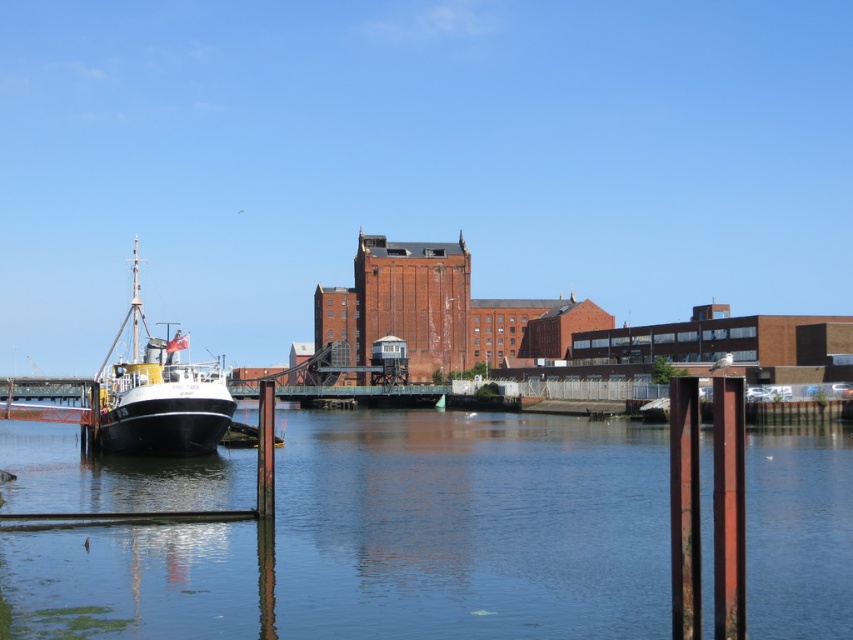
Does clear blue water at center appear over polished black ship at left?

No.

Can you confirm if clear blue water at center is smaller than polished black ship at left?

Correct, clear blue water at center occupies less space than polished black ship at left.

Locate an element on the screen. Image resolution: width=853 pixels, height=640 pixels. clear blue water at center is located at coordinates (469, 525).